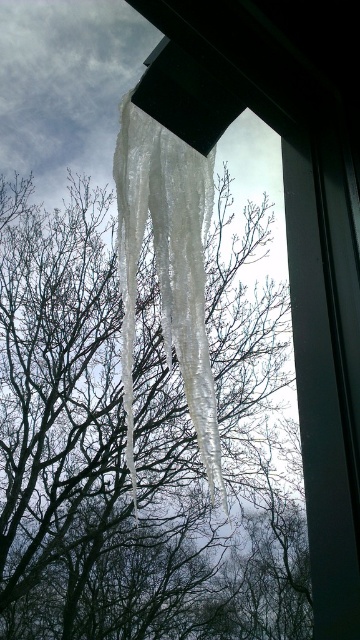
You are an architect analyzing the structural integrity of icicles. Given that the transparent ice icicles at center are wider than the clear ice icicles at center, which of the two might be more prone to breaking under their own weight?

The transparent ice icicles at center are wider than the clear ice icicles at center. Since wider icicles have more mass and are subject to greater gravitational force, they are more prone to breaking under their own weight.

You are an ice sculptor observing the icicles in the image. You need to choose the best icicle for a sculpture that requires a large amount of ice. Which one would you select between the transparent ice icicles at center and the clear ice icicles at center?

The transparent ice icicles at center are larger in size than the clear ice icicles at center, so you should choose the transparent ice icicles at center for the sculpture that requires a large amount of ice.